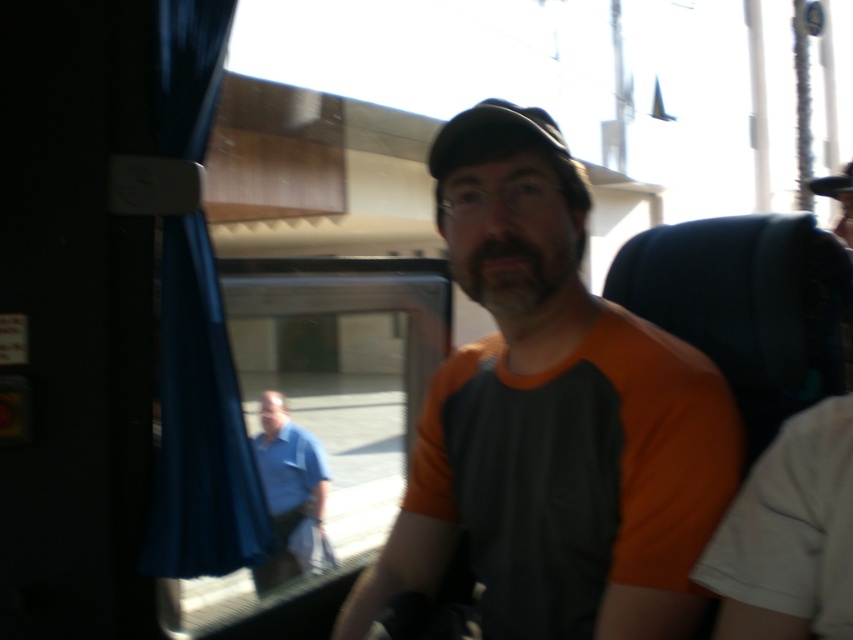
Question: Which point appears closest to the camera in this image?

Choices:
 (A) (283, 440)
 (B) (650, 532)
 (C) (573, 262)

Answer: (B)

Question: Can you confirm if orange fabric shirt at center is bigger than blue cotton shirt at lower left?

Choices:
 (A) no
 (B) yes

Answer: (A)

Question: Does dark brown fuzzy beard at center appear over blue cotton shirt at lower left?

Choices:
 (A) yes
 (B) no

Answer: (A)

Question: Does orange fabric shirt at center appear under blue cotton shirt at lower left?

Choices:
 (A) yes
 (B) no

Answer: (B)

Question: Based on their relative distances, which object is farther from the dark brown fuzzy beard at center?

Choices:
 (A) orange fabric shirt at center
 (B) blue cotton shirt at lower left

Answer: (B)

Question: Which point is closer to the camera?

Choices:
 (A) (587, 422)
 (B) (480, 266)
 (C) (260, 420)

Answer: (A)